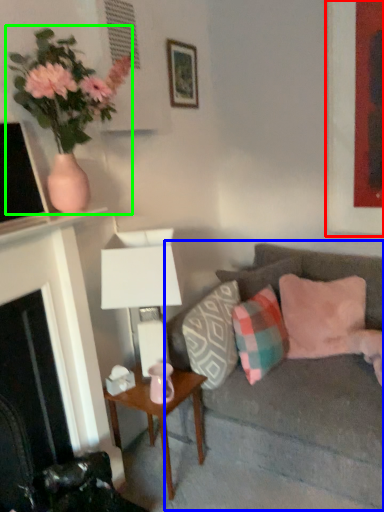
Question: Considering the real-world distances, which object is closest to picture frame (highlighted by a red box)? studio couch (highlighted by a blue box) or houseplant (highlighted by a green box).

Choices:
 (A) studio couch
 (B) houseplant

Answer: (A)